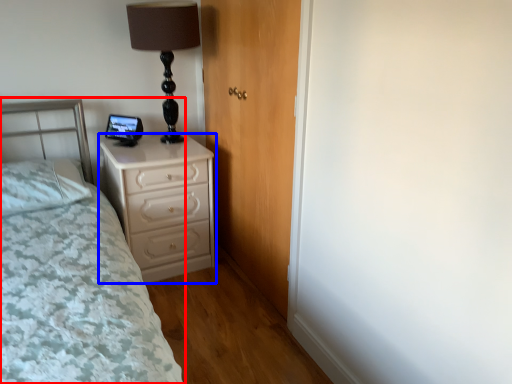
Question: Among these objects, which one is farthest to the camera, bed (highlighted by a red box) or chest of drawers (highlighted by a blue box)?

Choices:
 (A) bed
 (B) chest of drawers

Answer: (B)